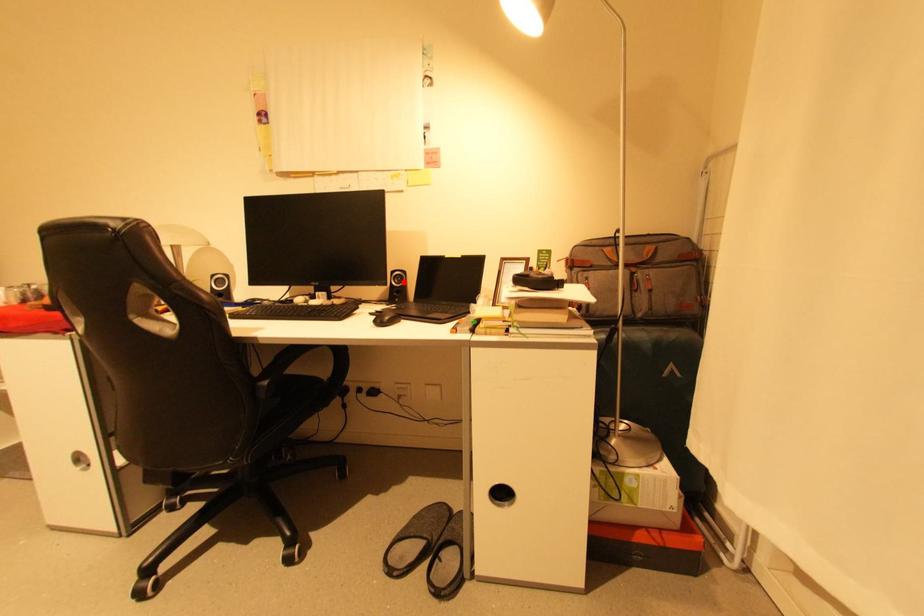
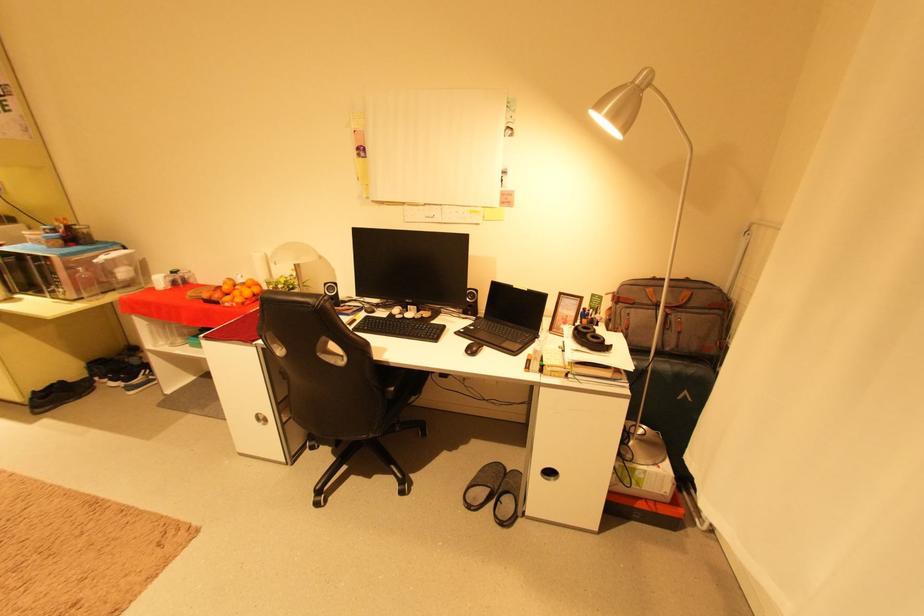
The point at the highlighted location is marked in the first image. Where is the corresponding point in the second image?

(477, 298)